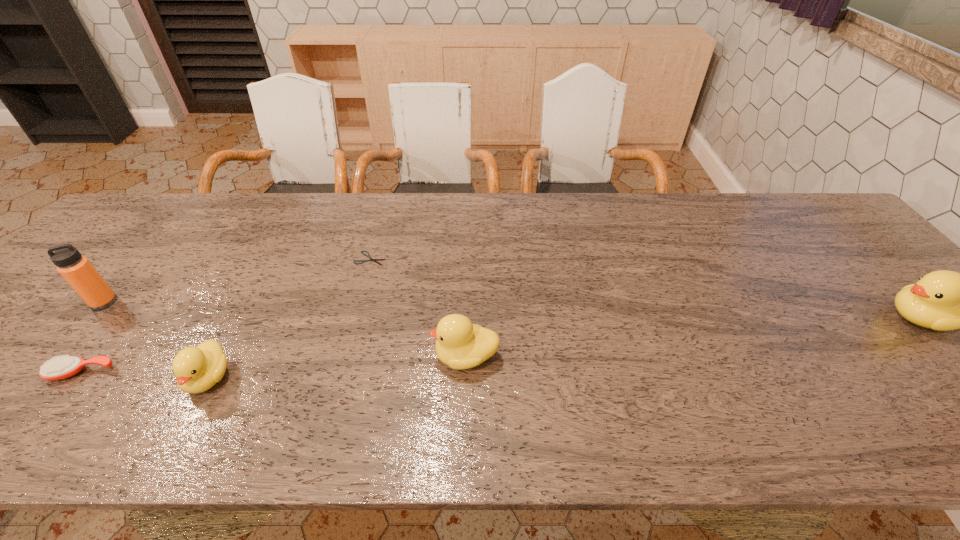
Image resolution: width=960 pixels, height=540 pixels. I want to click on free area in between the fifth tallest object and the thermos bottle, so click(92, 338).

At what (x,y) coordinates should I click in order to perform the action: click on vacant area that lies between the tallest object and the shortest object. Please return your answer as a coordinate pair (x, y). The image size is (960, 540). Looking at the image, I should click on (237, 280).

The image size is (960, 540). What are the coordinates of `object that stands as the fourth closest to the third object from right to left` in the screenshot? It's located at (80, 274).

Select which object is the fourth closest to the leftmost duckling. Please provide its 2D coordinates. Your answer should be formatted as a tuple, i.e. [(x, y)], where the tuple contains the x and y coordinates of a point satisfying the conditions above.

[(460, 344)]

Identify which duckling is located as the nearest to the rightmost object. Please provide its 2D coordinates. Your answer should be formatted as a tuple, i.e. [(x, y)], where the tuple contains the x and y coordinates of a point satisfying the conditions above.

[(460, 344)]

Select which duckling is the closest to the fourth shortest object. Please provide its 2D coordinates. Your answer should be formatted as a tuple, i.e. [(x, y)], where the tuple contains the x and y coordinates of a point satisfying the conditions above.

[(197, 369)]